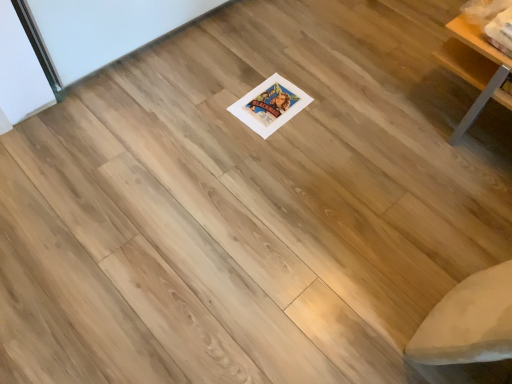
You are a GUI agent. You are given a task and a screenshot of the screen. Output one action in this format:
    pyautogui.click(x=<x>, y=<y>)
    Task: Click on the vacant region to the left of light brown wooden table at upper right
    The image size is (512, 384).
    Given the screenshot: What is the action you would take?
    pyautogui.click(x=370, y=109)